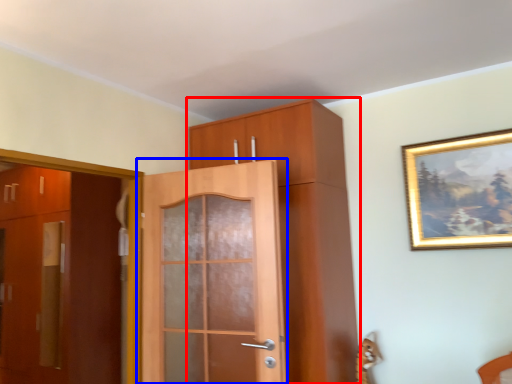
Question: Among these objects, which one is nearest to the camera, cabinetry (highlighted by a red box) or door (highlighted by a blue box)?

Choices:
 (A) cabinetry
 (B) door

Answer: (B)